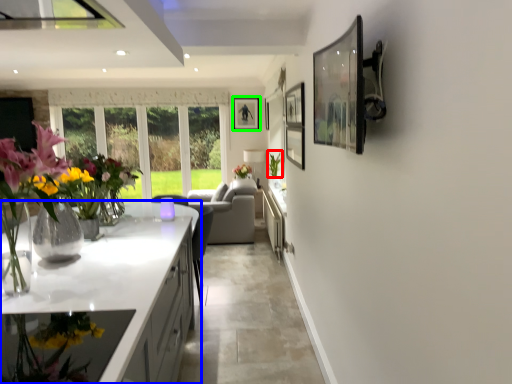
Question: Considering the real-world distances, which object is closest to plant (highlighted by a red box)? countertop (highlighted by a blue box) or picture frame (highlighted by a green box).

Choices:
 (A) countertop
 (B) picture frame

Answer: (B)